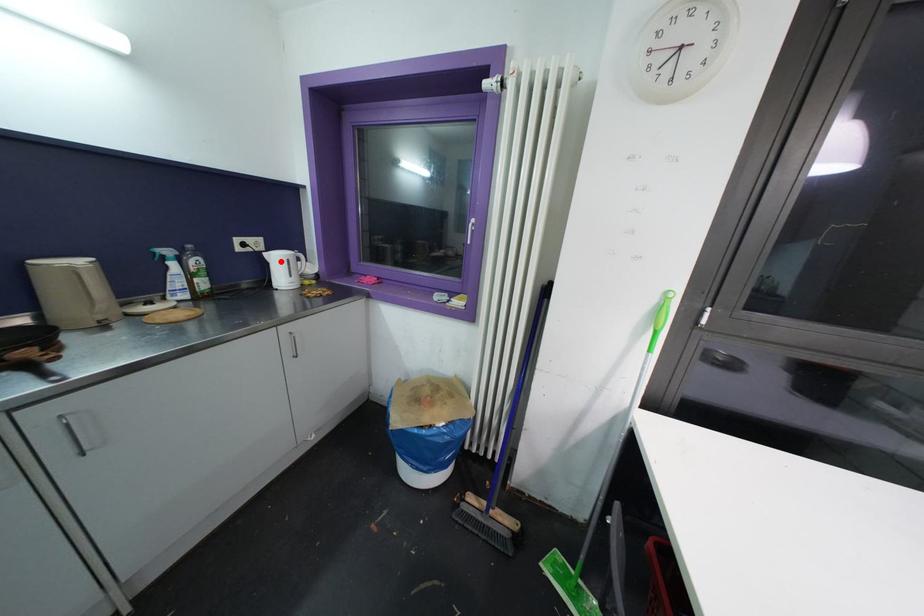
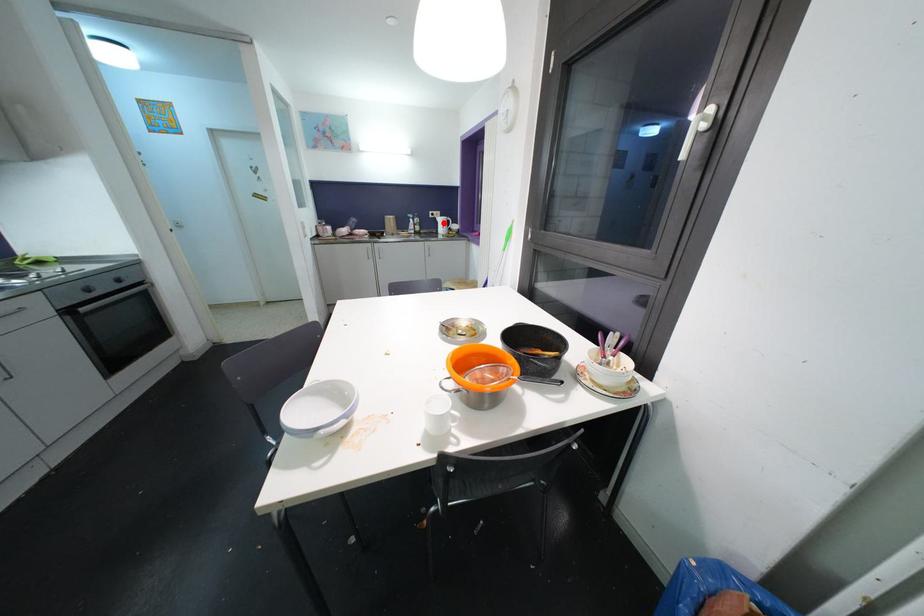
I am providing you with two images of the same scene from different viewpoints. A red point is marked on the first image and another point is marked on the second image. Does the point marked in image1 correspond to the same location as the one in image2?

Yes